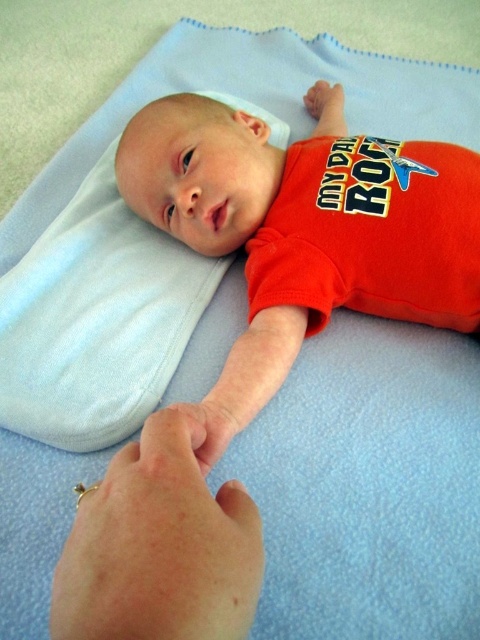
Who is taller, matte orange shirt at center or soft blue fabric pillow at upper left?

Standing taller between the two is matte orange shirt at center.

Locate an element on the screen. Image resolution: width=480 pixels, height=640 pixels. matte orange shirt at center is located at coordinates (304, 230).